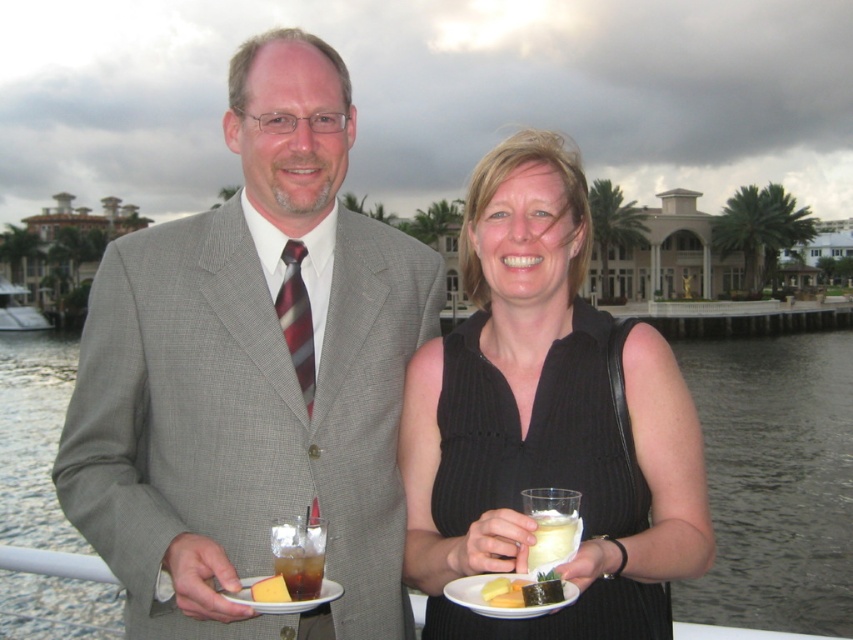
I want to click on gray textured suit at center, so click(252, 372).

Between gray textured suit at center and white opaque cup at center, which one has more height?

gray textured suit at center is taller.

Which is in front, point (254, 188) or point (549, 556)?

Point (549, 556) is more forward.

You are a GUI agent. You are given a task and a screenshot of the screen. Output one action in this format:
    pyautogui.click(x=<x>, y=<y>)
    Task: Click on the gray textured suit at center
    This screenshot has height=640, width=853.
    Given the screenshot: What is the action you would take?
    pyautogui.click(x=252, y=372)

From the picture: Can you confirm if black ribbed dress at center is smaller than white matte plate at lower center?

Incorrect, black ribbed dress at center is not smaller in size than white matte plate at lower center.

Image resolution: width=853 pixels, height=640 pixels. Describe the element at coordinates (547, 419) in the screenshot. I see `black ribbed dress at center` at that location.

Does point (494, 374) come closer to viewer compared to point (573, 595)?

No, (494, 374) is further to viewer.

At what (x,y) coordinates should I click in order to perform the action: click on black ribbed dress at center. Please return your answer as a coordinate pair (x, y). The height and width of the screenshot is (640, 853). Looking at the image, I should click on (547, 419).

Is black ribbed dress at center above white opaque cup at center?

Yes, black ribbed dress at center is above white opaque cup at center.

Which is in front, point (672, 474) or point (538, 570)?

Point (538, 570) is more forward.

Is point (514, 337) farther from camera compared to point (558, 538)?

Yes, point (514, 337) is behind point (558, 538).

The height and width of the screenshot is (640, 853). What are the coordinates of `black ribbed dress at center` in the screenshot? It's located at (547, 419).